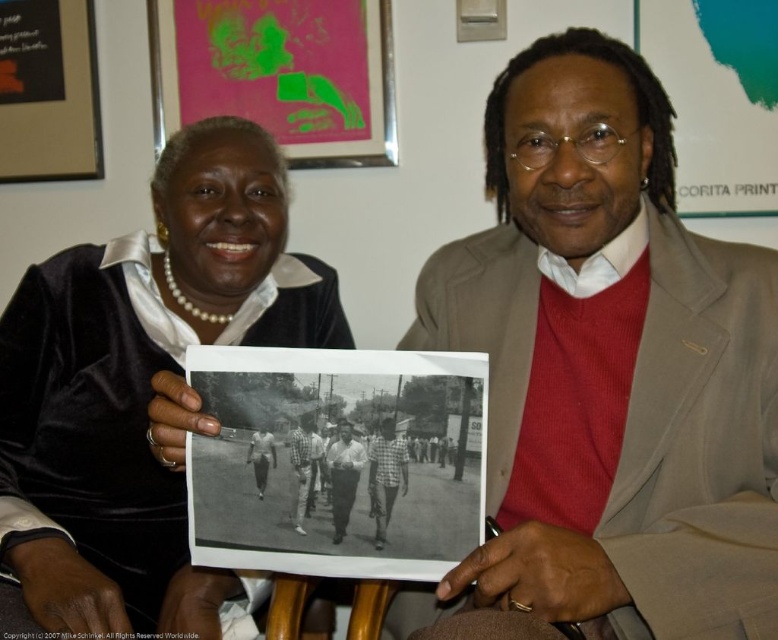
Between plaid shirt at center and white cotton shirt at center, which one is positioned higher?

white cotton shirt at center is higher up.

Is plaid shirt at center further to the viewer compared to white cotton shirt at center?

No, plaid shirt at center is in front of white cotton shirt at center.

The width and height of the screenshot is (778, 640). Find the location of `plaid shirt at center`. plaid shirt at center is located at coordinates (303, 467).

Is matte gray blazer at center wider than checkered fabric shirt at center?

Indeed, matte gray blazer at center has a greater width compared to checkered fabric shirt at center.

I want to click on matte gray blazer at center, so click(x=608, y=365).

Where is `matte gray blazer at center`? The image size is (778, 640). matte gray blazer at center is located at coordinates point(608,365).

Does matte gray blazer at center appear over white cotton shirt at center?

Indeed, matte gray blazer at center is positioned over white cotton shirt at center.

Where is `matte gray blazer at center`? Image resolution: width=778 pixels, height=640 pixels. matte gray blazer at center is located at coordinates (608, 365).